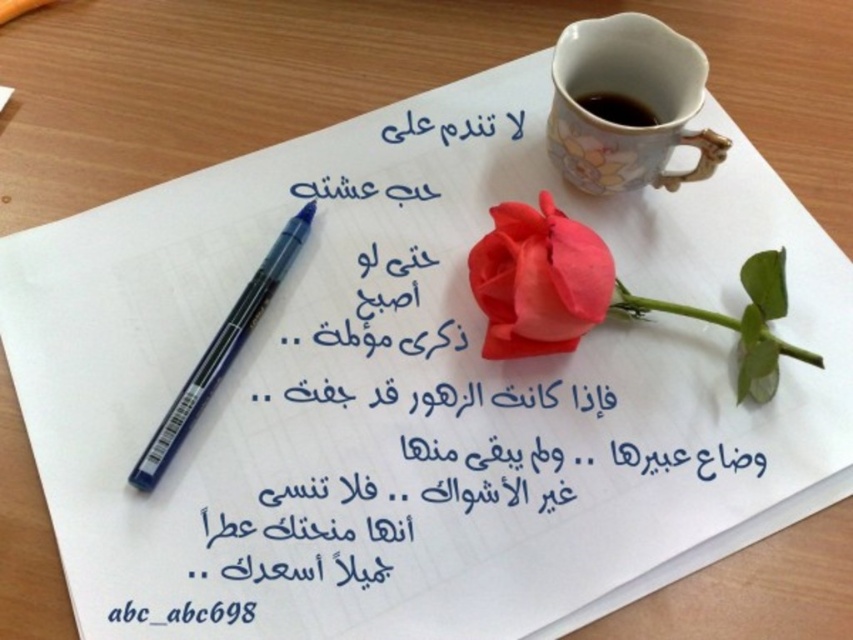
Based on the photo, you are an artist trying to replicate the scene on a canvas. The scene has a matte pink rose at center. To ensure accuracy, where should you place the rose on your canvas using a coordinate system where the bottom left corner is the origin?

The matte pink rose at center should be placed at coordinates approximately 0.439 on the x axis and 0.632 on the y axis, as per the 2D location provided.

You are an artist trying to place a new painting on the wooden surface. You have two points marked on the surface at coordinates point (569,36) and point (606,308). Which point is closer to you as you stand in front of the wooden surface?

Point (569,36) is further to the viewer than point (606,308), so the closer point to you is point (606,308).